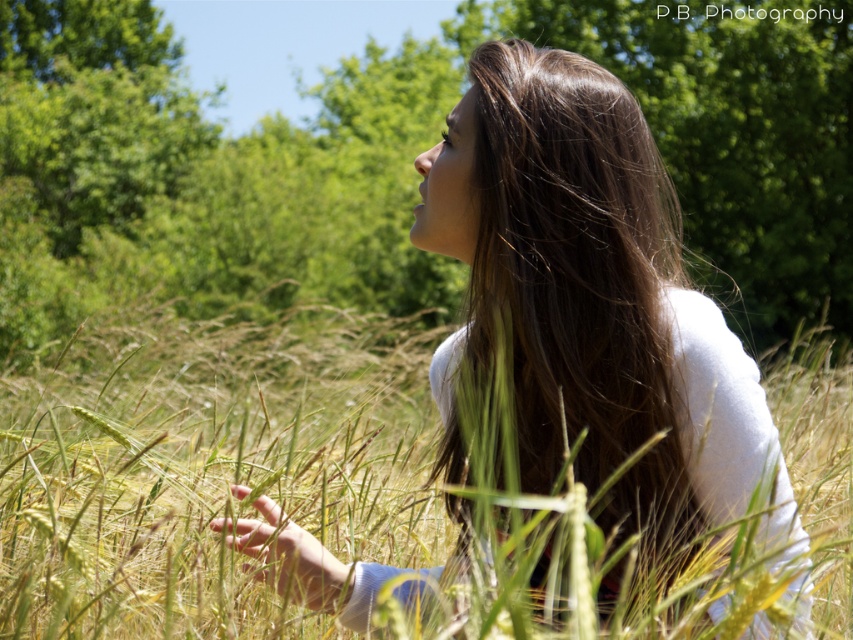
You are a photographer wanting to capture the white soft fabric at center and the brown silky hair at center in a single frame. Based on their positions, which object should you adjust your camera to focus on first if you want to include both in your shot?

The white soft fabric at center is to the left of brown silky hair at center, so you should focus on the white soft fabric at center first to ensure both are included in the frame.